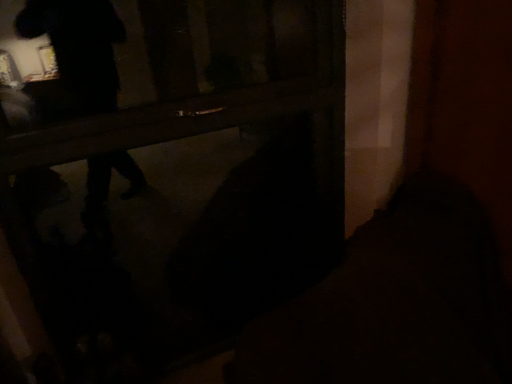
The width and height of the screenshot is (512, 384). I want to click on black matte bag at lower center, so click(395, 303).

This screenshot has width=512, height=384. What do you see at coordinates (395, 303) in the screenshot?
I see `black matte bag at lower center` at bounding box center [395, 303].

The width and height of the screenshot is (512, 384). What do you see at coordinates (191, 180) in the screenshot?
I see `wooden door at center` at bounding box center [191, 180].

What is the approximate width of wooden door at center?

The width of wooden door at center is 5.32 inches.

Where is `wooden door at center`? This screenshot has width=512, height=384. wooden door at center is located at coordinates (191, 180).

I want to click on black matte bag at lower center, so click(395, 303).

Between black matte bag at lower center and wooden door at center, which one appears on the left side from the viewer's perspective?

wooden door at center.

Does black matte bag at lower center lie in front of wooden door at center?

Yes, it is.

Which is closer, (329, 355) or (327, 94)?

Point (329, 355) is positioned closer to the camera compared to point (327, 94).

From the image's perspective, is black matte bag at lower center under wooden door at center?

Yes.

From a real-world perspective, which is physically above, black matte bag at lower center or wooden door at center?

From a 3D spatial view, wooden door at center is above.

From the picture: Looking at their sizes, would you say black matte bag at lower center is wider or thinner than wooden door at center?

Considering their sizes, black matte bag at lower center looks broader than wooden door at center.

Who is shorter, black matte bag at lower center or wooden door at center?

Standing shorter between the two is black matte bag at lower center.

Is black matte bag at lower center smaller than wooden door at center?

Incorrect, black matte bag at lower center is not smaller in size than wooden door at center.

Is black matte bag at lower center not inside wooden door at center?

black matte bag at lower center is positioned outside wooden door at center.

Is black matte bag at lower center positioned far away from wooden door at center?

black matte bag at lower center is actually quite close to wooden door at center.

Could you tell me if black matte bag at lower center is facing wooden door at center?

No.

Can you tell me how much black matte bag at lower center and wooden door at center differ in facing direction?

90.6 degrees.

Identify the location of door behind the black matte bag at lower center. (191, 180).

Is wooden door at center at the right side of black matte bag at lower center?

Incorrect, wooden door at center is not on the right side of black matte bag at lower center.

Is the position of wooden door at center more distant than that of black matte bag at lower center?

Yes.

Between point (4, 142) and point (375, 293), which one is positioned in front?

The point (4, 142) is closer to the camera.

From the image's perspective, which one is positioned higher, wooden door at center or black matte bag at lower center?

wooden door at center, from the image's perspective.

From a real-world perspective, is wooden door at center physically located above or below black matte bag at lower center?

wooden door at center is above black matte bag at lower center.

Considering the sizes of objects wooden door at center and black matte bag at lower center in the image provided, who is thinner, wooden door at center or black matte bag at lower center?

wooden door at center.

Considering the relative sizes of wooden door at center and black matte bag at lower center in the image provided, is wooden door at center shorter than black matte bag at lower center?

Incorrect, the height of wooden door at center does not fall short of that of black matte bag at lower center.

Can you confirm if wooden door at center is smaller than black matte bag at lower center?

Correct, wooden door at center occupies less space than black matte bag at lower center.

Which is correct: wooden door at center is inside black matte bag at lower center, or outside of it?

wooden door at center is located beyond the bounds of black matte bag at lower center.

Are wooden door at center and black matte bag at lower center far apart?

No, there isn't a large distance between wooden door at center and black matte bag at lower center.

Is wooden door at center facing towards black matte bag at lower center?

Yes, wooden door at center is facing black matte bag at lower center.

How much distance is there between wooden door at center and black matte bag at lower center?

A distance of 22.48 inches exists between wooden door at center and black matte bag at lower center.

What are the coordinates of `door located above the black matte bag at lower center (from the image's perspective)` in the screenshot? It's located at (191, 180).

Locate an element on the screen. This screenshot has height=384, width=512. dark below the wooden door at center (from a real-world perspective) is located at coordinates (395, 303).

In order to click on door that appears on the left of black matte bag at lower center in this screenshot , I will do `click(191, 180)`.